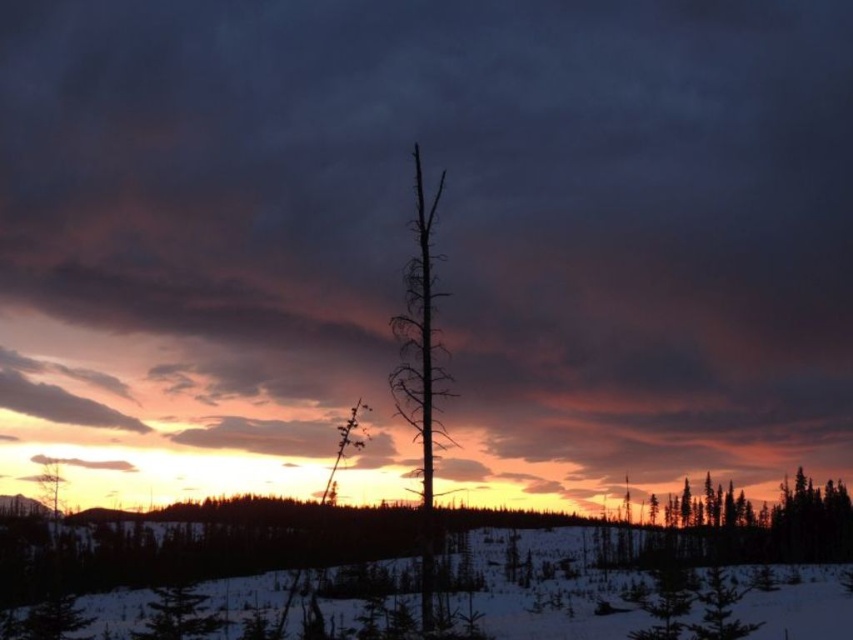
Is white powdery snow at lower center to the right of smooth brown tree trunk at lower left from the viewer's perspective?

Indeed, white powdery snow at lower center is positioned on the right side of smooth brown tree trunk at lower left.

Who is more forward, (584, 541) or (61, 477)?

Point (584, 541) is more forward.

Which is in front, point (463, 608) or point (57, 509)?

Point (463, 608) is in front.

This screenshot has width=853, height=640. What are the coordinates of `white powdery snow at lower center` in the screenshot? It's located at (550, 588).

Looking at this image, is white powdery snow at lower center in front of green matte tree at center?

That is True.

Does white powdery snow at lower center have a lesser width compared to green matte tree at center?

No.

Where is `white powdery snow at lower center`? This screenshot has width=853, height=640. white powdery snow at lower center is located at coordinates pos(550,588).

Who is positioned more to the left, white powdery snow at lower center or silhouette deadwood at center?

silhouette deadwood at center is more to the left.

Who is more distant from viewer, (308, 609) or (418, 410)?

Positioned behind is point (308, 609).

The width and height of the screenshot is (853, 640). I want to click on white powdery snow at lower center, so click(550, 588).